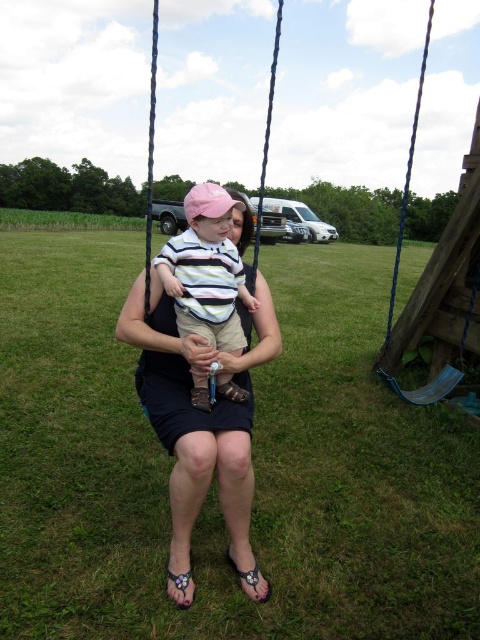
Which of these two, striped cotton shirt at center or wooden swing at center, stands shorter?

Standing shorter between the two is striped cotton shirt at center.

Between point (190, 250) and point (149, 141), which one is positioned in front?

Point (190, 250)

Locate an element on the screen. striped cotton shirt at center is located at coordinates (206, 269).

Locate an element on the screen. striped cotton shirt at center is located at coordinates (206, 269).

Can you confirm if black leather sandal at lower center is thinner than black fabric sandal at lower center?

No.

Which of these two, black leather sandal at lower center or black fabric sandal at lower center, stands taller?

Standing taller between the two is black fabric sandal at lower center.

Is point (236, 572) positioned in front of point (177, 586)?

No, (236, 572) is behind (177, 586).

Find the location of a particular element. The width and height of the screenshot is (480, 640). black leather sandal at lower center is located at coordinates (244, 572).

Looking at this image, is wooden swing at center below black fabric sandal at lower center?

Incorrect, wooden swing at center is not positioned below black fabric sandal at lower center.

Looking at this image, is wooden swing at center smaller than black fabric sandal at lower center?

No.

Find the location of a particular element. This screenshot has width=480, height=640. wooden swing at center is located at coordinates (266, 140).